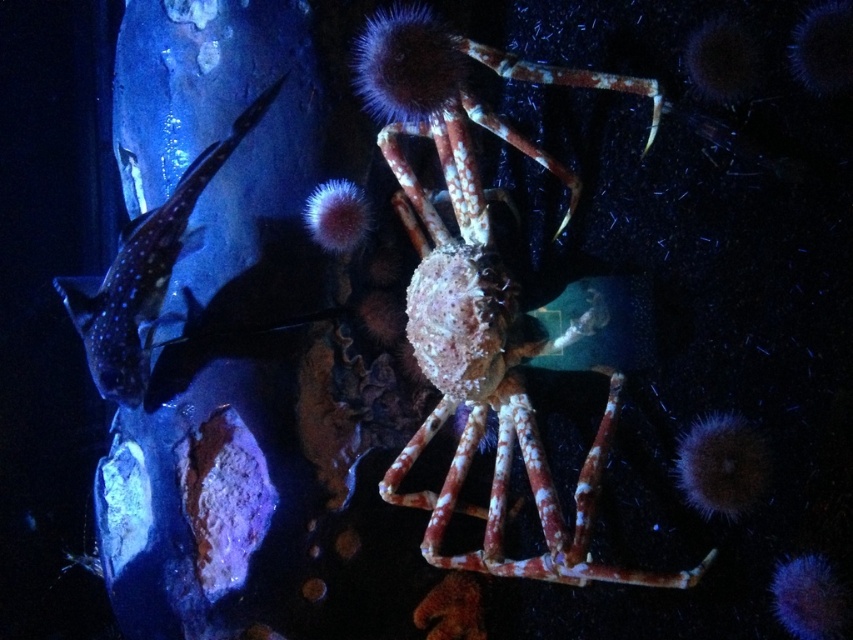
From the picture: Does speckled orange crab at center have a greater height compared to shiny blue fish at left?

Yes.

Is point (492, 563) farther from camera compared to point (251, 122)?

That is False.

This screenshot has width=853, height=640. Identify the location of speckled orange crab at center. (480, 296).

This screenshot has height=640, width=853. Identify the location of speckled orange crab at center. (480, 296).